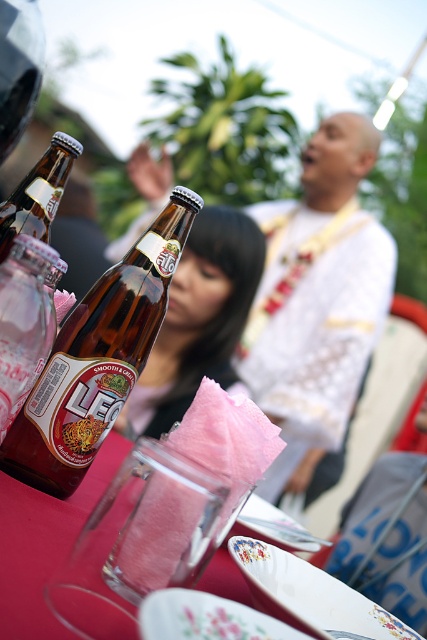
Question: Among these points, which one is nearest to the camera?

Choices:
 (A) 319,246
 (B) 23,228

Answer: (B)

Question: Which object is positioned farthest from the brown glass bottle at center?

Choices:
 (A) brown glass bottle at center-left
 (B) brown glass bottle at left

Answer: (B)

Question: Is smooth white shirt at center positioned in front of brown glass bottle at left?

Choices:
 (A) yes
 (B) no

Answer: (B)

Question: Is pink cotton candy at center thinner than brown glass bottle at center-left?

Choices:
 (A) no
 (B) yes

Answer: (A)

Question: Observing the image, what is the correct spatial positioning of smooth white shirt at center in reference to brown glass bottle at center-left?

Choices:
 (A) above
 (B) below

Answer: (A)

Question: Which point appears farthest from the camera in this image?

Choices:
 (A) (49, 336)
 (B) (160, 278)

Answer: (B)